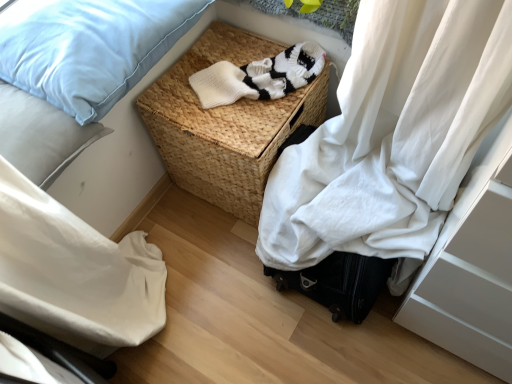
Locate an element on the screen. The height and width of the screenshot is (384, 512). light blue fabric pillow at upper left, which is the first pillow from bottom to top is located at coordinates (41, 135).

The image size is (512, 384). Find the location of `light blue fabric pillow at upper left, acting as the 2th pillow starting from the bottom`. light blue fabric pillow at upper left, acting as the 2th pillow starting from the bottom is located at coordinates (89, 48).

Describe the element at coordinates (89, 48) in the screenshot. The width and height of the screenshot is (512, 384). I see `light blue fabric pillow at upper left, acting as the 2th pillow starting from the bottom` at that location.

I want to click on white knitted sweater at center, so pos(259,76).

Is light blue fabric pillow at upper left, which is the first pillow from bottom to top, next to white knitted sweater at center?

No.

How different are the orientations of light blue fabric pillow at upper left, marked as the second pillow in a top-to-bottom arrangement, and white knitted sweater at center in degrees?

32.4 degrees separate the facing orientations of light blue fabric pillow at upper left, marked as the second pillow in a top-to-bottom arrangement, and white knitted sweater at center.

The image size is (512, 384). I want to click on clothing below the light blue fabric pillow at upper left, which is the first pillow from bottom to top (from a real-world perspective), so click(259, 76).

Does point (21, 129) lie behind point (326, 260)?

No, (21, 129) is closer to viewer.

Can black hard suitcase at lower right be found inside light blue fabric pillow at upper left, marked as the second pillow in a top-to-bottom arrangement?

No, black hard suitcase at lower right is not inside light blue fabric pillow at upper left, marked as the second pillow in a top-to-bottom arrangement.

Does light blue fabric pillow at upper left, which is the first pillow from bottom to top, come in front of black hard suitcase at lower right?

Yes, light blue fabric pillow at upper left, which is the first pillow from bottom to top, is in front of black hard suitcase at lower right.

From the image's perspective, is light blue fabric pillow at upper left, marked as the second pillow in a top-to-bottom arrangement, located above black hard suitcase at lower right?

Correct, light blue fabric pillow at upper left, marked as the second pillow in a top-to-bottom arrangement, appears higher than black hard suitcase at lower right in the image.

Is light blue fabric pillow at upper left, which is the first pillow from bottom to top, aimed at light blue fabric pillow at upper left, the 1th pillow positioned from the top?

No, light blue fabric pillow at upper left, which is the first pillow from bottom to top, is not aimed at light blue fabric pillow at upper left, the 1th pillow positioned from the top.

Which object is closer to the camera, light blue fabric pillow at upper left, marked as the second pillow in a top-to-bottom arrangement, or light blue fabric pillow at upper left, the 1th pillow positioned from the top?

light blue fabric pillow at upper left, marked as the second pillow in a top-to-bottom arrangement, is closer to the camera.

Consider the image. What's the angular difference between light blue fabric pillow at upper left, which is the first pillow from bottom to top, and light blue fabric pillow at upper left, acting as the 2th pillow starting from the bottom,'s facing directions?

The angular difference between light blue fabric pillow at upper left, which is the first pillow from bottom to top, and light blue fabric pillow at upper left, acting as the 2th pillow starting from the bottom, is 5.74e-05 degrees.

Is white knitted sweater at center positioned far away from light blue fabric pillow at upper left, which is the first pillow from bottom to top?

Actually, white knitted sweater at center and light blue fabric pillow at upper left, which is the first pillow from bottom to top, are a little close together.

Can you confirm if white knitted sweater at center is thinner than light blue fabric pillow at upper left, which is the first pillow from bottom to top?

Indeed, white knitted sweater at center has a lesser width compared to light blue fabric pillow at upper left, which is the first pillow from bottom to top.

From the image's perspective, is white knitted sweater at center positioned above or below light blue fabric pillow at upper left, marked as the second pillow in a top-to-bottom arrangement?

Based on their image positions, white knitted sweater at center is located above light blue fabric pillow at upper left, marked as the second pillow in a top-to-bottom arrangement.

Considering the points (354, 268) and (255, 65), which point is behind, point (354, 268) or point (255, 65)?

Point (255, 65)

From a real-world perspective, is black hard suitcase at lower right below white knitted sweater at center?

Yes, from a real-world perspective, black hard suitcase at lower right is under white knitted sweater at center.

Where is `luggage below the white knitted sweater at center (from a real-world perspective)`? luggage below the white knitted sweater at center (from a real-world perspective) is located at coordinates (339, 283).

Is black hard suitcase at lower right taller or shorter than white knitted sweater at center?

Clearly, black hard suitcase at lower right is taller compared to white knitted sweater at center.

Can you confirm if woven brown picnic basket at center is positioned to the right of light blue fabric pillow at upper left, acting as the 2th pillow starting from the bottom?

Correct, you'll find woven brown picnic basket at center to the right of light blue fabric pillow at upper left, acting as the 2th pillow starting from the bottom.

Could you tell me if woven brown picnic basket at center is turned towards light blue fabric pillow at upper left, the 1th pillow positioned from the top?

No, woven brown picnic basket at center is not turned towards light blue fabric pillow at upper left, the 1th pillow positioned from the top.

This screenshot has height=384, width=512. Find the location of `picnic basket on the right of the light blue fabric pillow at upper left, acting as the 2th pillow starting from the bottom`. picnic basket on the right of the light blue fabric pillow at upper left, acting as the 2th pillow starting from the bottom is located at coordinates (225, 124).

Is light blue fabric pillow at upper left, acting as the 2th pillow starting from the bottom, in contact with white knitted sweater at center?

No, light blue fabric pillow at upper left, acting as the 2th pillow starting from the bottom, is not with white knitted sweater at center.

Considering the positions of objects light blue fabric pillow at upper left, acting as the 2th pillow starting from the bottom, and white knitted sweater at center in the image provided, who is more to the right, light blue fabric pillow at upper left, acting as the 2th pillow starting from the bottom, or white knitted sweater at center?

From the viewer's perspective, white knitted sweater at center appears more on the right side.

In the scene shown: How different are the orientations of light blue fabric pillow at upper left, the 1th pillow positioned from the top, and white knitted sweater at center in degrees?

The angular difference between light blue fabric pillow at upper left, the 1th pillow positioned from the top, and white knitted sweater at center is 32.4 degrees.

Is light blue fabric pillow at upper left, the 1th pillow positioned from the top, smaller than white knitted sweater at center?

Incorrect, light blue fabric pillow at upper left, the 1th pillow positioned from the top, is not smaller in size than white knitted sweater at center.

Locate an element on the screen. The width and height of the screenshot is (512, 384). clothing that is above the light blue fabric pillow at upper left, which is the first pillow from bottom to top (from the image's perspective) is located at coordinates (259, 76).

The width and height of the screenshot is (512, 384). In the image, there is a light blue fabric pillow at upper left, marked as the second pillow in a top-to-bottom arrangement. Find the location of `luggage below it (from the image's perspective)`. luggage below it (from the image's perspective) is located at coordinates (339, 283).

Which object lies further to the anchor point light blue fabric pillow at upper left, marked as the second pillow in a top-to-bottom arrangement, black hard suitcase at lower right or white knitted sweater at center?

The object further to light blue fabric pillow at upper left, marked as the second pillow in a top-to-bottom arrangement, is black hard suitcase at lower right.

Based on their spatial positions, is light blue fabric pillow at upper left, the 1th pillow positioned from the top, or black hard suitcase at lower right closer to light blue fabric pillow at upper left, which is the first pillow from bottom to top?

light blue fabric pillow at upper left, the 1th pillow positioned from the top.

From the image, which object appears to be nearer to woven brown picnic basket at center, black hard suitcase at lower right or light blue fabric pillow at upper left, marked as the second pillow in a top-to-bottom arrangement?

Among the two, light blue fabric pillow at upper left, marked as the second pillow in a top-to-bottom arrangement, is located nearer to woven brown picnic basket at center.

Which object lies nearer to the anchor point light blue fabric pillow at upper left, the 1th pillow positioned from the top, light blue fabric pillow at upper left, marked as the second pillow in a top-to-bottom arrangement, or woven brown picnic basket at center?

light blue fabric pillow at upper left, marked as the second pillow in a top-to-bottom arrangement, is closer to light blue fabric pillow at upper left, the 1th pillow positioned from the top.

In the scene shown: Looking at the image, which one is located closer to black hard suitcase at lower right, light blue fabric pillow at upper left, the 1th pillow positioned from the top, or white knitted sweater at center?

white knitted sweater at center lies closer to black hard suitcase at lower right than the other object.

Estimate the real-world distances between objects in this image. Which object is further from white knitted sweater at center, light blue fabric pillow at upper left, acting as the 2th pillow starting from the bottom, or woven brown picnic basket at center?

Based on the image, light blue fabric pillow at upper left, acting as the 2th pillow starting from the bottom, appears to be further to white knitted sweater at center.

From the image, which object appears to be nearer to white knitted sweater at center, black hard suitcase at lower right or woven brown picnic basket at center?

woven brown picnic basket at center is positioned closer to the anchor white knitted sweater at center.

Estimate the real-world distances between objects in this image. Which object is closer to white knitted sweater at center, light blue fabric pillow at upper left, which is the first pillow from bottom to top, or woven brown picnic basket at center?

woven brown picnic basket at center is closer to white knitted sweater at center.

What are the coordinates of `picnic basket located between light blue fabric pillow at upper left, marked as the second pillow in a top-to-bottom arrangement, and black hard suitcase at lower right in the left-right direction` in the screenshot? It's located at (225, 124).

This screenshot has width=512, height=384. I want to click on picnic basket located between light blue fabric pillow at upper left, which is the first pillow from bottom to top, and white knitted sweater at center in the left-right direction, so coord(225,124).

This screenshot has width=512, height=384. I want to click on pillow situated between light blue fabric pillow at upper left, marked as the second pillow in a top-to-bottom arrangement, and black hard suitcase at lower right from left to right, so click(89, 48).

Identify the location of picnic basket between light blue fabric pillow at upper left, acting as the 2th pillow starting from the bottom, and white knitted sweater at center. The width and height of the screenshot is (512, 384). (225, 124).